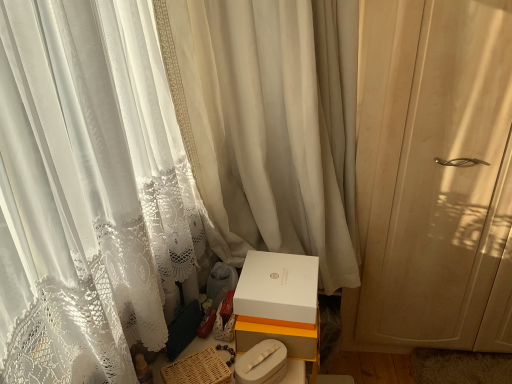
Image resolution: width=512 pixels, height=384 pixels. In order to click on white matte box at center, the second box in the top-to-bottom sequence in this screenshot , I will do `click(262, 363)`.

The width and height of the screenshot is (512, 384). What do you see at coordinates (278, 290) in the screenshot?
I see `white matte box at lower center, the second box when ordered from bottom to top` at bounding box center [278, 290].

Find the location of `woven brown basket at lower center`. woven brown basket at lower center is located at coordinates (198, 369).

From a real-world perspective, which object stands above the other?

white sheer curtain at center, positioned as the 2th curtain in right-to-left order.

Is point (362, 286) closer to viewer compared to point (253, 52)?

No, (362, 286) is behind (253, 52).

From the image's perspective, is white lace curtain at right, which ranks as the 2th curtain in left-to-right order, located above or below white sheer curtain at center, positioned as the 2th curtain in right-to-left order?

Clearly, from the image's perspective, white lace curtain at right, which ranks as the 2th curtain in left-to-right order, is below white sheer curtain at center, positioned as the 2th curtain in right-to-left order.

What's the angular difference between white lace curtain at right, which ranks as the 2th curtain in left-to-right order, and white sheer curtain at center, which appears as the first curtain when viewed from the left,'s facing directions?

The facing directions of white lace curtain at right, which ranks as the 2th curtain in left-to-right order, and white sheer curtain at center, which appears as the first curtain when viewed from the left, are 45.7 degrees apart.

From a real-world perspective, is white matte box at lower center, the second box when ordered from bottom to top, positioned over woven brown basket at lower center based on gravity?

Yes, from a real-world perspective, white matte box at lower center, the second box when ordered from bottom to top, is above woven brown basket at lower center.

Who is smaller, white matte box at lower center, the second box when ordered from bottom to top, or woven brown basket at lower center?

woven brown basket at lower center.

Considering the sizes of objects white matte box at lower center, the first box in the top-to-bottom sequence, and woven brown basket at lower center in the image provided, who is thinner, white matte box at lower center, the first box in the top-to-bottom sequence, or woven brown basket at lower center?

With smaller width is woven brown basket at lower center.

Is white matte box at lower center, the second box when ordered from bottom to top, situated inside woven brown basket at lower center or outside?

white matte box at lower center, the second box when ordered from bottom to top, exists outside the volume of woven brown basket at lower center.

Does point (439, 23) come farther from viewer compared to point (194, 368)?

Yes, it is.

Between white lace curtain at right, arranged as the 1th curtain when viewed from the right, and woven brown basket at lower center, which one has smaller width?

white lace curtain at right, arranged as the 1th curtain when viewed from the right, is thinner.

Is white lace curtain at right, which ranks as the 2th curtain in left-to-right order, taller or shorter than woven brown basket at lower center?

white lace curtain at right, which ranks as the 2th curtain in left-to-right order, is taller than woven brown basket at lower center.

Which is more to the right, white lace curtain at right, arranged as the 1th curtain when viewed from the right, or woven brown basket at lower center?

Positioned to the right is white lace curtain at right, arranged as the 1th curtain when viewed from the right.

Considering the sizes of objects woven brown basket at lower center and white lace curtain at right, which ranks as the 2th curtain in left-to-right order, in the image provided, who is taller, woven brown basket at lower center or white lace curtain at right, which ranks as the 2th curtain in left-to-right order,?

With more height is white lace curtain at right, which ranks as the 2th curtain in left-to-right order.

From a real-world perspective, is woven brown basket at lower center above or below white lace curtain at right, which ranks as the 2th curtain in left-to-right order?

In terms of real-world spatial position, woven brown basket at lower center is below white lace curtain at right, which ranks as the 2th curtain in left-to-right order.

Does woven brown basket at lower center contain white lace curtain at right, arranged as the 1th curtain when viewed from the right?

No, white lace curtain at right, arranged as the 1th curtain when viewed from the right, is located outside of woven brown basket at lower center.

Considering their positions, is woven brown basket at lower center located in front of or behind white lace curtain at right, which ranks as the 2th curtain in left-to-right order?

Visually, woven brown basket at lower center is located in front of white lace curtain at right, which ranks as the 2th curtain in left-to-right order.

Is white matte box at lower center, the first box in the top-to-bottom sequence, situated inside white lace curtain at right, arranged as the 1th curtain when viewed from the right, or outside?

white matte box at lower center, the first box in the top-to-bottom sequence, lies outside white lace curtain at right, arranged as the 1th curtain when viewed from the right.

Who is bigger, white matte box at lower center, the second box when ordered from bottom to top, or white lace curtain at right, arranged as the 1th curtain when viewed from the right?

white lace curtain at right, arranged as the 1th curtain when viewed from the right, is bigger.

Is white matte box at lower center, the first box in the top-to-bottom sequence, turned away from white lace curtain at right, which ranks as the 2th curtain in left-to-right order?

That's not correct — white matte box at lower center, the first box in the top-to-bottom sequence, is not looking away from white lace curtain at right, which ranks as the 2th curtain in left-to-right order.

Considering the relative positions of white matte box at lower center, the first box in the top-to-bottom sequence, and white lace curtain at right, arranged as the 1th curtain when viewed from the right, in the image provided, is white matte box at lower center, the first box in the top-to-bottom sequence, to the left of white lace curtain at right, arranged as the 1th curtain when viewed from the right, from the viewer's perspective?

Yes, white matte box at lower center, the first box in the top-to-bottom sequence, is to the left of white lace curtain at right, arranged as the 1th curtain when viewed from the right.

Can you confirm if white lace curtain at right, which ranks as the 2th curtain in left-to-right order, is smaller than white matte box at lower center, the first box in the top-to-bottom sequence?

Incorrect, white lace curtain at right, which ranks as the 2th curtain in left-to-right order, is not smaller in size than white matte box at lower center, the first box in the top-to-bottom sequence.

From a real-world perspective, which curtain is the 1st one above the white matte box at lower center, the first box in the top-to-bottom sequence? Please provide its 2D coordinates.

[(433, 175)]

Looking at this image, is white lace curtain at right, which ranks as the 2th curtain in left-to-right order, thinner than white matte box at lower center, the first box in the top-to-bottom sequence?

Yes, white lace curtain at right, which ranks as the 2th curtain in left-to-right order, is thinner than white matte box at lower center, the first box in the top-to-bottom sequence.

Can we say white lace curtain at right, arranged as the 1th curtain when viewed from the right, lies outside white matte box at lower center, the first box in the top-to-bottom sequence?

Yes, white lace curtain at right, arranged as the 1th curtain when viewed from the right, is outside of white matte box at lower center, the first box in the top-to-bottom sequence.

Considering the sizes of white sheer curtain at center, positioned as the 2th curtain in right-to-left order, and woven brown basket at lower center in the image, is white sheer curtain at center, positioned as the 2th curtain in right-to-left order, wider or thinner than woven brown basket at lower center?

Clearly, white sheer curtain at center, positioned as the 2th curtain in right-to-left order, has more width compared to woven brown basket at lower center.

From the picture: How much distance is there between white sheer curtain at center, positioned as the 2th curtain in right-to-left order, and woven brown basket at lower center?

white sheer curtain at center, positioned as the 2th curtain in right-to-left order, and woven brown basket at lower center are 26.95 inches apart.

Is white sheer curtain at center, positioned as the 2th curtain in right-to-left order, not close to woven brown basket at lower center?

No.

Who is bigger, white sheer curtain at center, positioned as the 2th curtain in right-to-left order, or woven brown basket at lower center?

white sheer curtain at center, positioned as the 2th curtain in right-to-left order.

You are a GUI agent. You are given a task and a screenshot of the screen. Output one action in this format:
    pyautogui.click(x=<x>, y=<y>)
    Task: Click on the curtain below the white sheer curtain at center, which appears as the first curtain when viewed from the left (from a real-world perspective)
    
    Given the screenshot: What is the action you would take?
    pyautogui.click(x=433, y=175)

Identify the location of the 2nd box to the right of the woven brown basket at lower center, counting from the anchor's position. This screenshot has height=384, width=512. coord(278,290).

Based on their spatial positions, is white matte box at lower center, the first box in the top-to-bottom sequence, or woven brown basket at lower center closer to white sheer curtain at center, positioned as the 2th curtain in right-to-left order?

white matte box at lower center, the first box in the top-to-bottom sequence, lies closer to white sheer curtain at center, positioned as the 2th curtain in right-to-left order, than the other object.

Considering their positions, is white sheer curtain at center, positioned as the 2th curtain in right-to-left order, positioned further to white matte box at lower center, the first box in the top-to-bottom sequence, than woven brown basket at lower center?

white sheer curtain at center, positioned as the 2th curtain in right-to-left order, lies further to white matte box at lower center, the first box in the top-to-bottom sequence, than the other object.

Based on the photo, estimate the real-world distances between objects in this image. Which object is closer to white matte box at lower center, the second box when ordered from bottom to top, white lace curtain at right, arranged as the 1th curtain when viewed from the right, or white matte box at center, the second box in the top-to-bottom sequence?

white matte box at center, the second box in the top-to-bottom sequence.

Estimate the real-world distances between objects in this image. Which object is closer to woven brown basket at lower center, white sheer curtain at center, which appears as the first curtain when viewed from the left, or white matte box at lower center, the first box in the top-to-bottom sequence?

white matte box at lower center, the first box in the top-to-bottom sequence, lies closer to woven brown basket at lower center than the other object.

Looking at the image, which one is located further to white matte box at lower center, the first box in the top-to-bottom sequence, white lace curtain at right, arranged as the 1th curtain when viewed from the right, or white sheer curtain at center, which appears as the first curtain when viewed from the left?

white lace curtain at right, arranged as the 1th curtain when viewed from the right, lies further to white matte box at lower center, the first box in the top-to-bottom sequence, than the other object.

Estimate the real-world distances between objects in this image. Which object is further from white lace curtain at right, arranged as the 1th curtain when viewed from the right, white matte box at lower center, the first box in the top-to-bottom sequence, or woven brown basket at lower center?

woven brown basket at lower center is further to white lace curtain at right, arranged as the 1th curtain when viewed from the right.

Estimate the real-world distances between objects in this image. Which object is further from white lace curtain at right, arranged as the 1th curtain when viewed from the right, white matte box at center, the second box in the top-to-bottom sequence, or white matte box at lower center, the first box in the top-to-bottom sequence?

Based on the image, white matte box at center, the second box in the top-to-bottom sequence, appears to be further to white lace curtain at right, arranged as the 1th curtain when viewed from the right.

Considering their positions, is white matte box at lower center, the first box in the top-to-bottom sequence, positioned further to white matte box at center, arranged as the 1th box when ordered from the bottom, than white lace curtain at right, arranged as the 1th curtain when viewed from the right?

white lace curtain at right, arranged as the 1th curtain when viewed from the right, lies further to white matte box at center, arranged as the 1th box when ordered from the bottom, than the other object.

Locate an element on the screen. This screenshot has height=384, width=512. box between white sheer curtain at center, which appears as the first curtain when viewed from the left, and white matte box at center, arranged as the 1th box when ordered from the bottom, in the vertical direction is located at coordinates (278, 290).

Where is `box between woven brown basket at lower center and white matte box at lower center, the first box in the top-to-bottom sequence, in the horizontal direction`? This screenshot has width=512, height=384. box between woven brown basket at lower center and white matte box at lower center, the first box in the top-to-bottom sequence, in the horizontal direction is located at coordinates (262, 363).

The width and height of the screenshot is (512, 384). I want to click on curtain situated between woven brown basket at lower center and white lace curtain at right, arranged as the 1th curtain when viewed from the right, from left to right, so click(x=270, y=122).

Identify the location of curtain located between white matte box at center, arranged as the 1th box when ordered from the bottom, and white lace curtain at right, which ranks as the 2th curtain in left-to-right order, in the left-right direction. (270, 122).